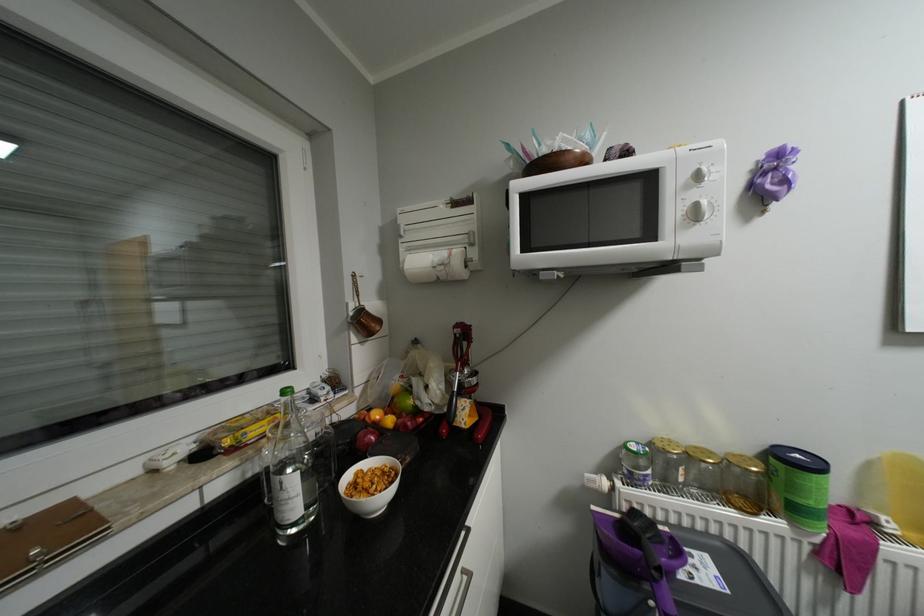
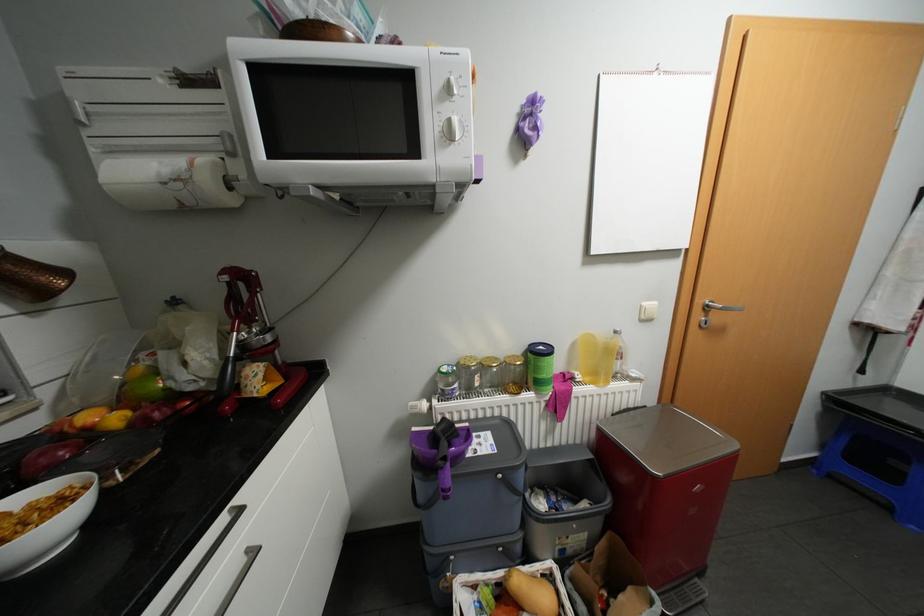
Find the pixel in the second image that matches (658,471) in the first image.

(464, 384)